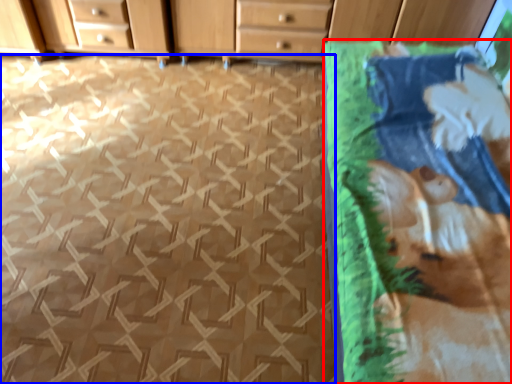
Question: Which object is closer to the camera taking this photo, blanket (highlighted by a red box) or tile (highlighted by a blue box)?

Choices:
 (A) blanket
 (B) tile

Answer: (A)